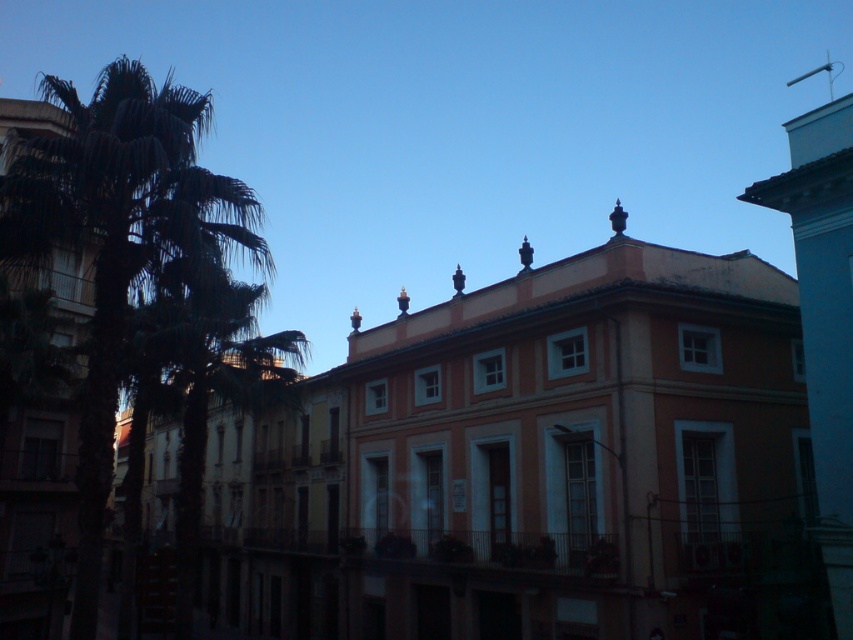
Question: Is dark green leafy palm tree at left bigger than shiny bronze finial at upper center?

Choices:
 (A) no
 (B) yes

Answer: (B)

Question: Which point is farther to the camera?

Choices:
 (A) shiny bronze finial at upper center
 (B) dark green leafy palm tree at left

Answer: (A)

Question: Can you confirm if dark green leafy palm tree at left is bigger than shiny bronze finial at upper center?

Choices:
 (A) no
 (B) yes

Answer: (B)

Question: Is dark green leafy palm tree at left bigger than shiny bronze finial at upper center?

Choices:
 (A) no
 (B) yes

Answer: (B)

Question: Among these points, which one is nearest to the camera?

Choices:
 (A) (608, 218)
 (B) (229, 230)

Answer: (B)